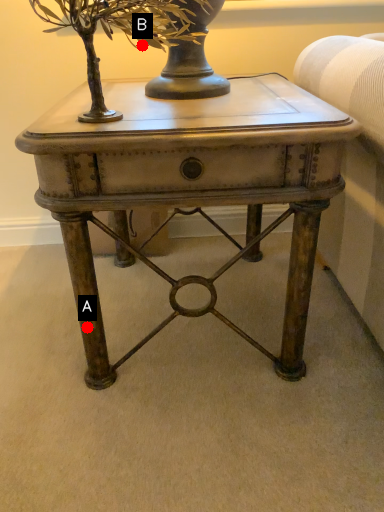
Question: Two points are circled on the image, labeled by A and B beside each circle. Which of the following is the closest to the observer?

Choices:
 (A) A is closer
 (B) B is closer

Answer: (B)